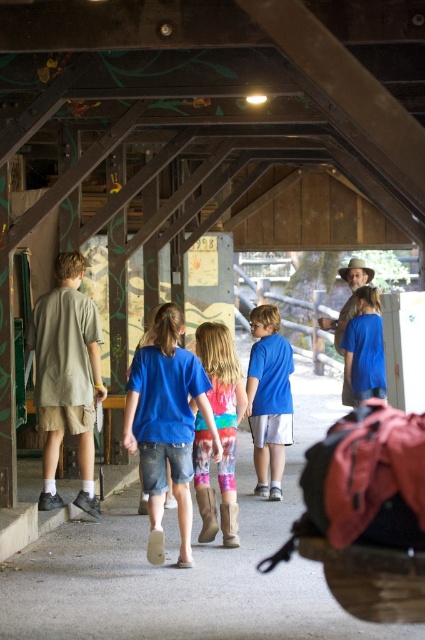
Between tie-dye fabric leggings at center and blue t-shirt at center, which one is positioned lower?

tie-dye fabric leggings at center is lower down.

Is point (220, 353) closer to camera compared to point (371, 392)?

Yes, point (220, 353) is in front of point (371, 392).

Who is more forward, [224,428] or [350,385]?

Point [224,428] is in front.

Locate an element on the screen. The height and width of the screenshot is (640, 425). tie-dye fabric leggings at center is located at coordinates (223, 413).

Does blue denim shorts at center appear on the right side of matte blue shirt at center?

Incorrect, blue denim shorts at center is not on the right side of matte blue shirt at center.

Describe the element at coordinates (167, 424) in the screenshot. This screenshot has height=640, width=425. I see `blue denim shorts at center` at that location.

Who is more distant from viewer, (x=164, y=480) or (x=269, y=424)?

The point (x=269, y=424) is more distant.

The image size is (425, 640). In order to click on blue denim shorts at center in this screenshot , I will do `click(167, 424)`.

Does matte blue shirt at center appear on the left side of blue t-shirt at center?

Indeed, matte blue shirt at center is positioned on the left side of blue t-shirt at center.

Does matte blue shirt at center have a greater height compared to blue t-shirt at center?

Indeed, matte blue shirt at center has a greater height compared to blue t-shirt at center.

Find the location of a particular element. matte blue shirt at center is located at coordinates (269, 397).